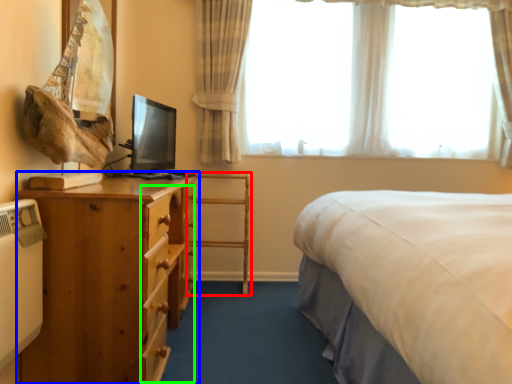
Question: Estimate the real-world distances between objects in this image. Which object is farther from chair (highlighted by a red box), nightstand (highlighted by a blue box) or drawer (highlighted by a green box)?

Choices:
 (A) nightstand
 (B) drawer

Answer: (A)